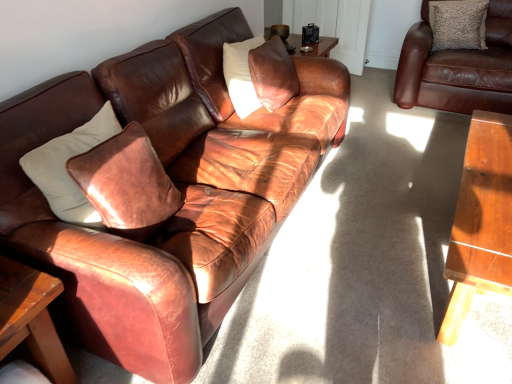
Question: Is point (48, 302) positioned closer to the camera than point (501, 33)?

Choices:
 (A) closer
 (B) farther

Answer: (A)

Question: Considering the relative positions of wooden table at lower left and brown leather couch at upper right, the first studio couch positioned from the right, in the image provided, is wooden table at lower left to the left or to the right of brown leather couch at upper right, the first studio couch positioned from the right,?

Choices:
 (A) left
 (B) right

Answer: (A)

Question: Estimate the real-world distances between objects in this image. Which object is farther from the textured beige pillow at upper right, which is counted as the first pillow, starting from the back?

Choices:
 (A) brown leather couch at upper right, which is counted as the second studio couch, starting from the left
 (B) wooden table at lower left
 (C) matte brown leather couch at left, marked as the 1th studio couch in a left-to-right arrangement
 (D) leather pillow at center, which ranks as the 2th pillow in right-to-left order

Answer: (B)

Question: Which object is positioned farthest from the brown leather couch at upper right, the first studio couch positioned from the right?

Choices:
 (A) wooden table at lower left
 (B) textured beige pillow at upper right, which is counted as the first pillow, starting from the back
 (C) leather pillow at center, acting as the first pillow starting from the left
 (D) matte brown leather couch at left, marked as the 1th studio couch in a left-to-right arrangement

Answer: (A)